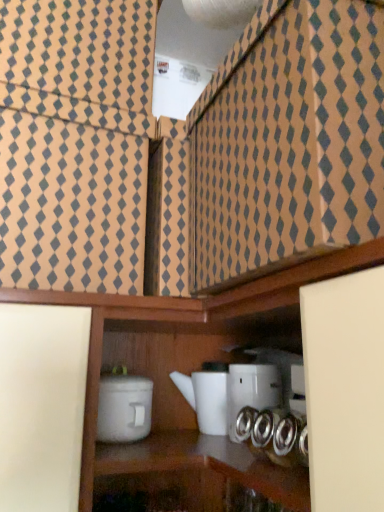
The width and height of the screenshot is (384, 512). What do you see at coordinates (206, 396) in the screenshot? I see `white glossy teapot at center, which is the 2th appliance from right to left` at bounding box center [206, 396].

Image resolution: width=384 pixels, height=512 pixels. I want to click on white matte container at lower center, which is counted as the third appliance, starting from the right, so click(124, 408).

Can you confirm if white glossy teapot at center, which ranks as the 1th appliance in right-to-left order, is bigger than white matte container at lower center, which is counted as the third appliance, starting from the right?

Incorrect, white glossy teapot at center, which ranks as the 1th appliance in right-to-left order, is not larger than white matte container at lower center, which is counted as the third appliance, starting from the right.

Identify the location of the 2nd appliance to the left of the white glossy teapot at center, which ranks as the 1th appliance in right-to-left order, starting your count from the anchor. The height and width of the screenshot is (512, 384). (124, 408).

Which object is positioned more to the left, white glossy teapot at center, which ranks as the 1th appliance in right-to-left order, or white matte container at lower center, which is counted as the third appliance, starting from the right?

From the viewer's perspective, white matte container at lower center, which is counted as the third appliance, starting from the right, appears more on the left side.

Is white glossy teapot at center, the 3th appliance from the left, looking in the opposite direction of white matte container at lower center, arranged as the 1th appliance when viewed from the left?

No, white glossy teapot at center, the 3th appliance from the left, is not facing away from white matte container at lower center, arranged as the 1th appliance when viewed from the left.

Would you say white glossy teapot at center, which is the 2th appliance from right to left, is inside or outside white matte container at lower center, arranged as the 1th appliance when viewed from the left?

white glossy teapot at center, which is the 2th appliance from right to left, is not enclosed by white matte container at lower center, arranged as the 1th appliance when viewed from the left.

Can you confirm if white glossy teapot at center, the second appliance when ordered from left to right, is positioned to the right of white matte container at lower center, which is counted as the third appliance, starting from the right?

Yes, white glossy teapot at center, the second appliance when ordered from left to right, is to the right of white matte container at lower center, which is counted as the third appliance, starting from the right.

From a real-world perspective, is white glossy teapot at center, which is the 2th appliance from right to left, on top of white matte container at lower center, arranged as the 1th appliance when viewed from the left?

Indeed, from a real-world perspective, white glossy teapot at center, which is the 2th appliance from right to left, stands above white matte container at lower center, arranged as the 1th appliance when viewed from the left.

How much distance is there between white glossy teapot at center, which is the 2th appliance from right to left, and white matte container at lower center, arranged as the 1th appliance when viewed from the left?

The distance of white glossy teapot at center, which is the 2th appliance from right to left, from white matte container at lower center, arranged as the 1th appliance when viewed from the left, is 15.74 centimeters.

Between white matte container at lower center, which is counted as the third appliance, starting from the right, and white glossy teapot at center, the second appliance when ordered from left to right, which one has larger size?

white glossy teapot at center, the second appliance when ordered from left to right, is bigger.

From the image's perspective, which is below, white matte container at lower center, arranged as the 1th appliance when viewed from the left, or white glossy teapot at center, the second appliance when ordered from left to right?

white glossy teapot at center, the second appliance when ordered from left to right, from the image's perspective.

Is white matte container at lower center, arranged as the 1th appliance when viewed from the left, taller than white glossy teapot at center, the second appliance when ordered from left to right?

No, white matte container at lower center, arranged as the 1th appliance when viewed from the left, is not taller than white glossy teapot at center, the second appliance when ordered from left to right.

Considering the sizes of objects white matte container at lower center, arranged as the 1th appliance when viewed from the left, and white glossy teapot at center, which is the 2th appliance from right to left, in the image provided, who is wider, white matte container at lower center, arranged as the 1th appliance when viewed from the left, or white glossy teapot at center, which is the 2th appliance from right to left,?

white glossy teapot at center, which is the 2th appliance from right to left, is wider.

Is white matte container at lower center, arranged as the 1th appliance when viewed from the left, situated inside white glossy teapot at center, which ranks as the 1th appliance in right-to-left order, or outside?

white matte container at lower center, arranged as the 1th appliance when viewed from the left, is outside white glossy teapot at center, which ranks as the 1th appliance in right-to-left order.

Considering the positions of points (125, 442) and (257, 409), is point (125, 442) closer to camera compared to point (257, 409)?

That is False.

Does white matte container at lower center, which is counted as the third appliance, starting from the right, turn towards white glossy teapot at center, which ranks as the 1th appliance in right-to-left order?

No, white matte container at lower center, which is counted as the third appliance, starting from the right, is not facing towards white glossy teapot at center, which ranks as the 1th appliance in right-to-left order.

From a real-world perspective, is white matte container at lower center, arranged as the 1th appliance when viewed from the left, above or below white glossy teapot at center, the 3th appliance from the left?

From a real-world perspective, white matte container at lower center, arranged as the 1th appliance when viewed from the left, is physically below white glossy teapot at center, the 3th appliance from the left.

Considering the sizes of objects white glossy teapot at center, which is the 2th appliance from right to left, and white glossy teapot at center, which ranks as the 1th appliance in right-to-left order, in the image provided, who is bigger, white glossy teapot at center, which is the 2th appliance from right to left, or white glossy teapot at center, which ranks as the 1th appliance in right-to-left order,?

A: white glossy teapot at center, which is the 2th appliance from right to left.

From a real-world perspective, is white glossy teapot at center, which is the 2th appliance from right to left, positioned above or below white glossy teapot at center, which ranks as the 1th appliance in right-to-left order?

white glossy teapot at center, which is the 2th appliance from right to left, is situated lower than white glossy teapot at center, which ranks as the 1th appliance in right-to-left order, in the real world.

Could you tell me if white glossy teapot at center, the second appliance when ordered from left to right, is facing white glossy teapot at center, the 3th appliance from the left?

Yes, white glossy teapot at center, the second appliance when ordered from left to right, is oriented towards white glossy teapot at center, the 3th appliance from the left.

Measure the distance between white glossy teapot at center, the second appliance when ordered from left to right, and white glossy teapot at center, the 3th appliance from the left.

The distance of white glossy teapot at center, the second appliance when ordered from left to right, from white glossy teapot at center, the 3th appliance from the left, is 2.84 inches.

From a real-world perspective, who is located lower, white glossy teapot at center, the 3th appliance from the left, or white glossy teapot at center, the second appliance when ordered from left to right?

In real-world perspective, white glossy teapot at center, the second appliance when ordered from left to right, is lower.

Does white glossy teapot at center, which ranks as the 1th appliance in right-to-left order, touch white glossy teapot at center, which is the 2th appliance from right to left?

Yes, white glossy teapot at center, which ranks as the 1th appliance in right-to-left order, is touching white glossy teapot at center, which is the 2th appliance from right to left.

Considering the points (240, 388) and (216, 428), which point is behind, point (240, 388) or point (216, 428)?

The point (216, 428) is more distant.

Is white glossy teapot at center, the 3th appliance from the left, oriented away from white glossy teapot at center, which is the 2th appliance from right to left?

No, white glossy teapot at center, the 3th appliance from the left, is not facing the opposite direction of white glossy teapot at center, which is the 2th appliance from right to left.

You are a GUI agent. You are given a task and a screenshot of the screen. Output one action in this format:
    pyautogui.click(x=<x>, y=<y>)
    Task: Click on the 2nd appliance above the white matte container at lower center, which is counted as the third appliance, starting from the right (from a real-world perspective)
    
    Given the screenshot: What is the action you would take?
    pyautogui.click(x=251, y=391)

I want to click on appliance below the white matte container at lower center, which is counted as the third appliance, starting from the right (from the image's perspective), so click(206, 396).

Estimate the real-world distances between objects in this image. Which object is further from white matte container at lower center, which is counted as the third appliance, starting from the right, white glossy teapot at center, the second appliance when ordered from left to right, or white glossy teapot at center, which ranks as the 1th appliance in right-to-left order?

white glossy teapot at center, which ranks as the 1th appliance in right-to-left order.

Estimate the real-world distances between objects in this image. Which object is closer to white glossy teapot at center, the second appliance when ordered from left to right, white matte container at lower center, which is counted as the third appliance, starting from the right, or white glossy teapot at center, which ranks as the 1th appliance in right-to-left order?

Based on the image, white glossy teapot at center, which ranks as the 1th appliance in right-to-left order, appears to be nearer to white glossy teapot at center, the second appliance when ordered from left to right.

From the image, which object appears to be farther from white matte container at lower center, arranged as the 1th appliance when viewed from the left, white glossy teapot at center, which ranks as the 1th appliance in right-to-left order, or white glossy teapot at center, which is the 2th appliance from right to left?

white glossy teapot at center, which ranks as the 1th appliance in right-to-left order, is positioned further to the anchor white matte container at lower center, arranged as the 1th appliance when viewed from the left.

Considering their positions, is white glossy teapot at center, the 3th appliance from the left, positioned further to white glossy teapot at center, the second appliance when ordered from left to right, than white matte container at lower center, which is counted as the third appliance, starting from the right?

Based on the image, white matte container at lower center, which is counted as the third appliance, starting from the right, appears to be further to white glossy teapot at center, the second appliance when ordered from left to right.

Considering their positions, is white matte container at lower center, arranged as the 1th appliance when viewed from the left, positioned closer to white glossy teapot at center, the 3th appliance from the left, than white glossy teapot at center, the second appliance when ordered from left to right?

white glossy teapot at center, the second appliance when ordered from left to right, is positioned closer to the anchor white glossy teapot at center, the 3th appliance from the left.

Looking at the image, which one is located closer to white glossy teapot at center, which ranks as the 1th appliance in right-to-left order, white glossy teapot at center, which is the 2th appliance from right to left, or white matte container at lower center, arranged as the 1th appliance when viewed from the left?

The object closer to white glossy teapot at center, which ranks as the 1th appliance in right-to-left order, is white glossy teapot at center, which is the 2th appliance from right to left.

Find the location of a particular element. This screenshot has width=384, height=512. appliance located between white matte container at lower center, arranged as the 1th appliance when viewed from the left, and white glossy teapot at center, which ranks as the 1th appliance in right-to-left order, in the left-right direction is located at coordinates (206, 396).